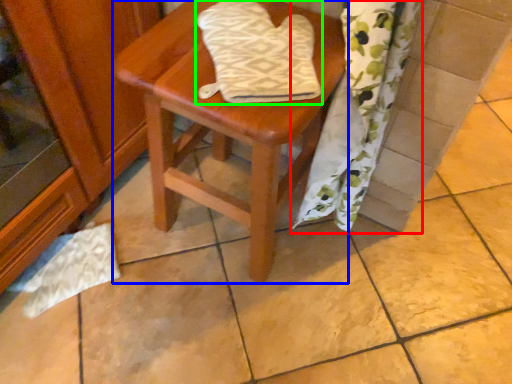
Question: Which object is positioned farthest from curtain (highlighted by a red box)? Select from stool (highlighted by a blue box) and beach towel (highlighted by a green box).

Choices:
 (A) stool
 (B) beach towel

Answer: (B)